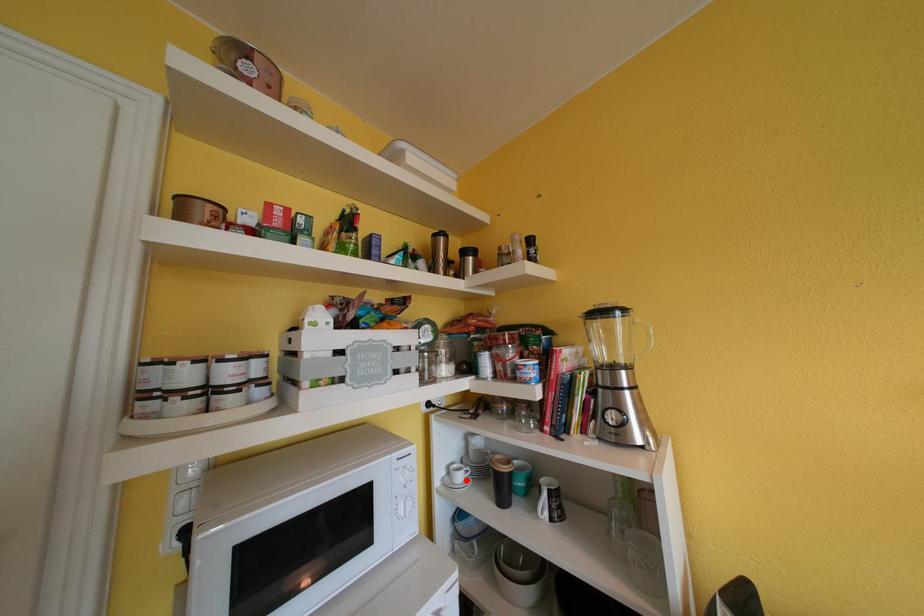
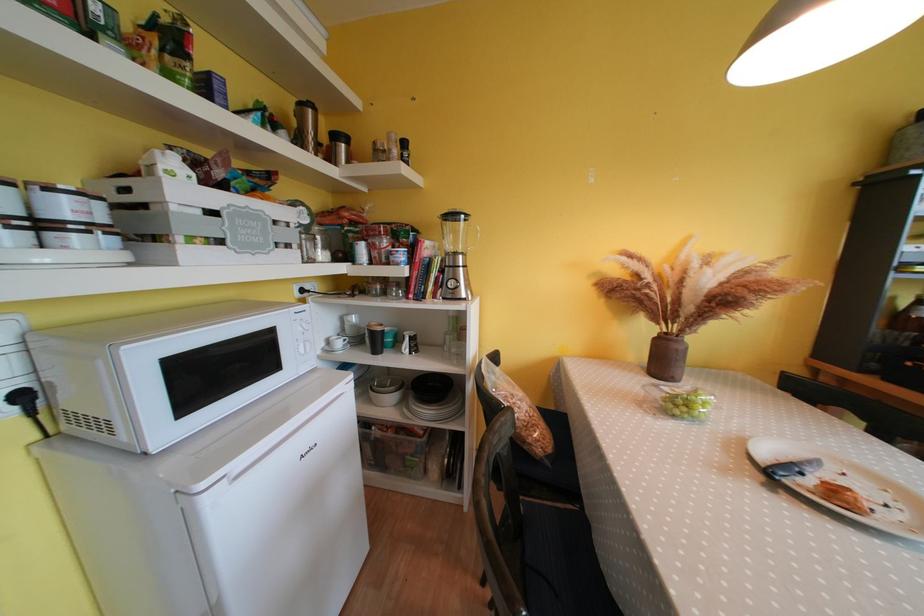
Find the pixel in the second image that matches the highlighted location in the first image.

(345, 347)